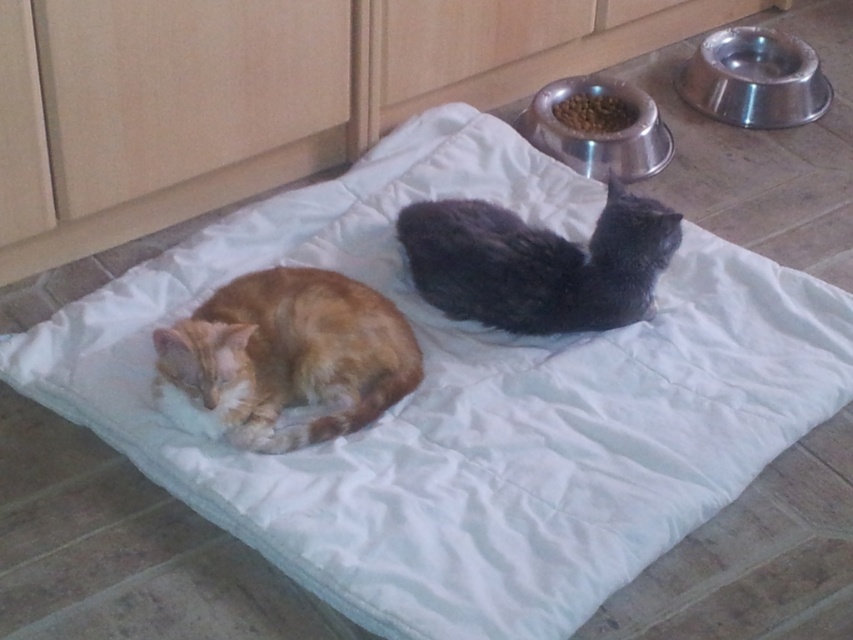
Question: Is black fluffy cat at center wider than brown matte food at upper center?

Choices:
 (A) no
 (B) yes

Answer: (B)

Question: Which object is closer to the camera taking this photo?

Choices:
 (A) orange fur cat at left
 (B) brown matte food at upper center

Answer: (A)

Question: Which of the following is the closest to the observer?

Choices:
 (A) (456, 268)
 (B) (209, 410)
 (C) (590, 92)

Answer: (B)

Question: Does metallic silver bowl at upper right appear under brown matte food at upper center?

Choices:
 (A) yes
 (B) no

Answer: (B)

Question: Which point is closer to the camera taking this photo?

Choices:
 (A) (569, 97)
 (B) (461, 208)
 (C) (550, 97)
 (D) (346, 294)

Answer: (D)

Question: Can you confirm if orange fur cat at left is positioned to the left of metallic silver bowl at upper right?

Choices:
 (A) yes
 (B) no

Answer: (A)